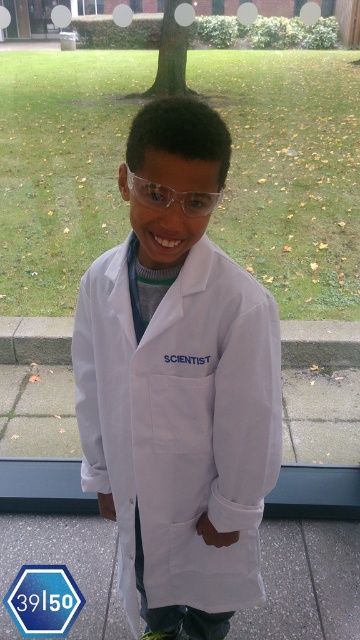
Does white matte lab coat at center appear under transparent plastic goggles at center?

Yes, white matte lab coat at center is below transparent plastic goggles at center.

Can you confirm if white matte lab coat at center is smaller than transparent plastic goggles at center?

Actually, white matte lab coat at center might be larger than transparent plastic goggles at center.

Is point (137, 472) positioned after point (162, 195)?

Yes.

Find the location of a particular element. This screenshot has height=640, width=360. white matte lab coat at center is located at coordinates point(180,422).